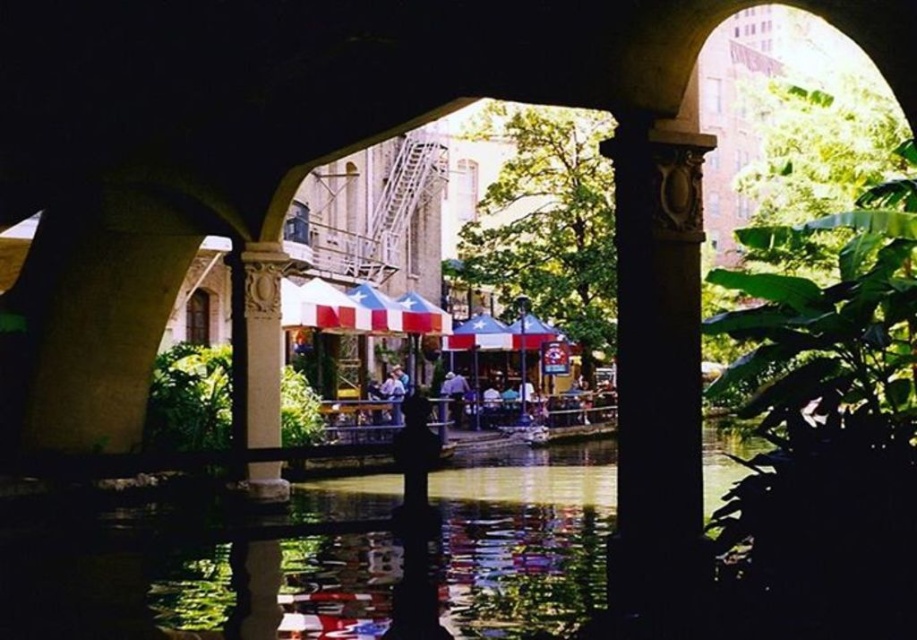
Question: Which object is farther from the camera taking this photo?

Choices:
 (A) carved stone column at center
 (B) green reflective water at center
 (C) white stone column at center

Answer: (C)

Question: Which point is farther from the camera taking this photo?

Choices:
 (A) (249, 477)
 (B) (244, 532)

Answer: (A)

Question: Is green reflective water at center thinner than carved stone column at center?

Choices:
 (A) no
 (B) yes

Answer: (A)

Question: Among these points, which one is farthest from the camera?

Choices:
 (A) [x=261, y=372]
 (B) [x=672, y=352]

Answer: (A)

Question: Is green reflective water at center smaller than carved stone column at center?

Choices:
 (A) yes
 (B) no

Answer: (B)

Question: Is carved stone column at center above white stone column at center?

Choices:
 (A) yes
 (B) no

Answer: (A)